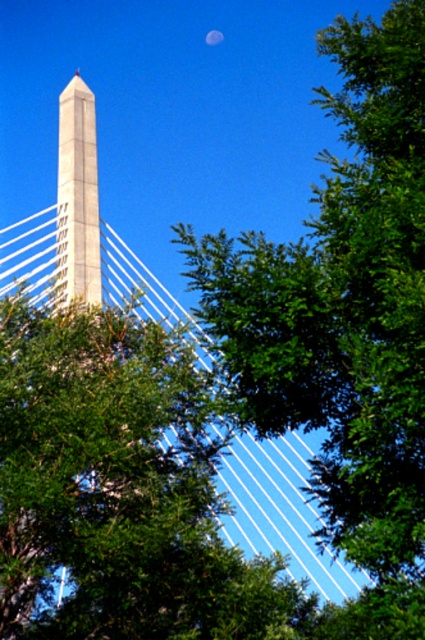
Is point (272, 273) closer to viewer compared to point (85, 150)?

Yes.

Who is taller, green leafy tree at upper right or white concrete obelisk at center?

green leafy tree at upper right

Is point (371, 132) closer to camera compared to point (76, 196)?

Yes, point (371, 132) is closer to viewer.

You are a GUI agent. You are given a task and a screenshot of the screen. Output one action in this format:
    pyautogui.click(x=<x>, y=<y>)
    Task: Click on the green leafy tree at upper right
    The image size is (425, 640).
    Given the screenshot: What is the action you would take?
    pyautogui.click(x=345, y=323)